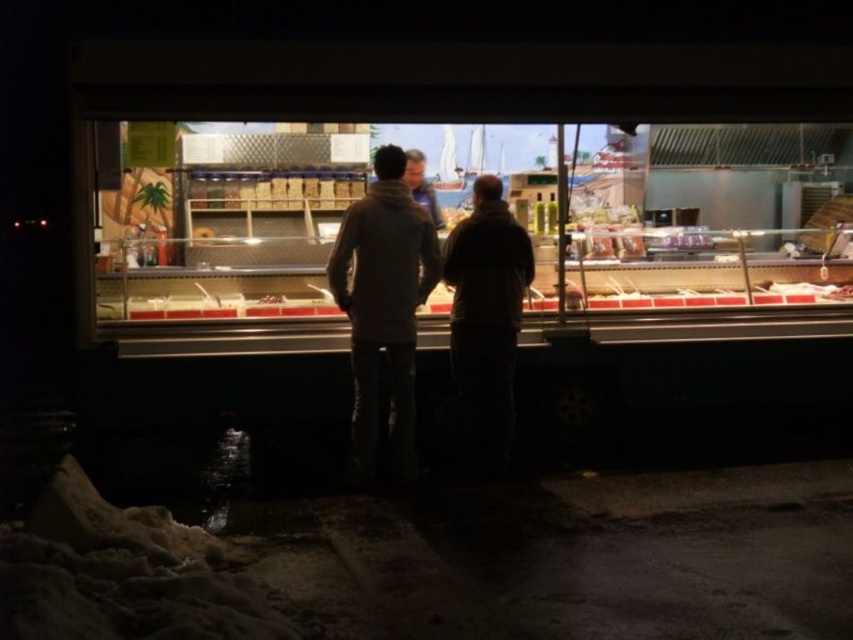
You are a customer standing outside the food truck and want to see the items inside. Which object, the transparent glass display case at center or the smooth beige jacket at center, would allow you to view the food items through it?

The transparent glass display case at center allows you to view the food items through it because it is made of transparent glass, unlike the smooth beige jacket at center which is an opaque clothing item.

You are standing in front of the food truck and see the point marked as point (386, 307). What object is located at that point?

The dark gray hoodie at center is located at point (386, 307).